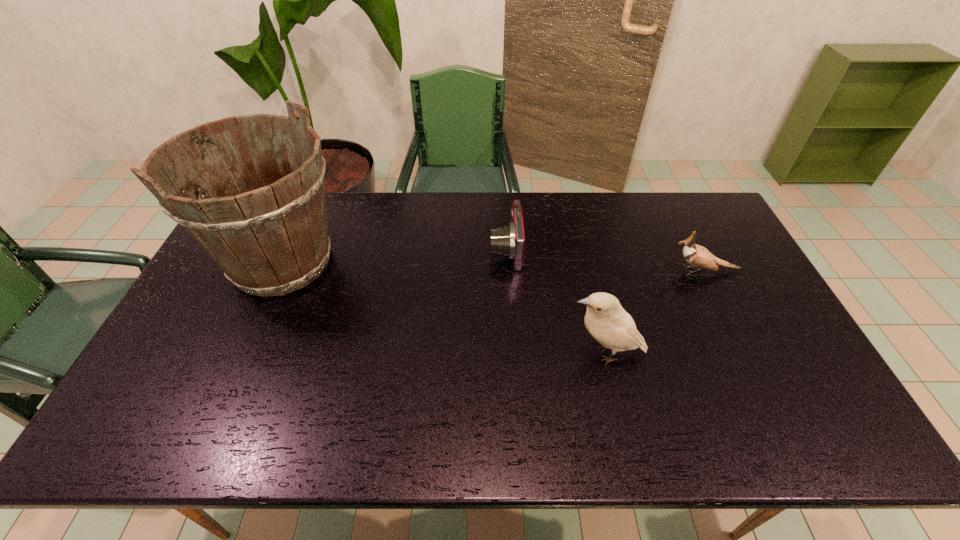
Locate an element on the screen. This screenshot has width=960, height=540. bucket is located at coordinates (270, 238).

Locate an element on the screen. This screenshot has height=540, width=960. the tallest object is located at coordinates (270, 238).

Locate an element on the screen. The height and width of the screenshot is (540, 960). the taller bird is located at coordinates (606, 320).

This screenshot has height=540, width=960. What are the coordinates of `the left bird` in the screenshot? It's located at click(606, 320).

The image size is (960, 540). In order to click on the second shortest object in this screenshot , I will do `click(696, 255)`.

Identify the location of the farther bird. (696, 255).

Locate an element on the screen. The width and height of the screenshot is (960, 540). the shortest object is located at coordinates (509, 241).

This screenshot has width=960, height=540. I want to click on the second object from left to right, so click(x=509, y=241).

You are a GUI agent. You are given a task and a screenshot of the screen. Output one action in this format:
    pyautogui.click(x=<x>, y=<y>)
    Task: Click on the free region located 0.050m on the front of the bucket
    
    Given the screenshot: What is the action you would take?
    pyautogui.click(x=252, y=328)

Locate an element on the screen. Image resolution: width=960 pixels, height=540 pixels. vacant region located 0.100m at the beak of the left bird is located at coordinates (527, 354).